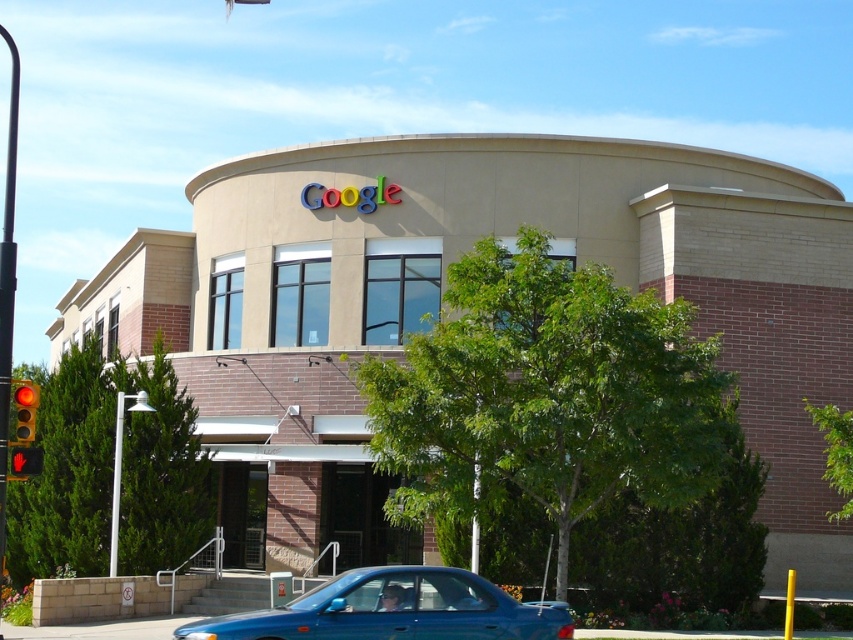
You are a delivery driver who needs to park your 5.5 meter long truck between the blue matte car at lower center and the red glass traffic light at left. Can you fit your truck there without moving either object?

The distance between the blue matte car at lower center and the red glass traffic light at left is 6.19 meters. Since your truck is 5.5 meters long, it can fit in the space between them as 6.19 meters is greater than 5.5 meters.